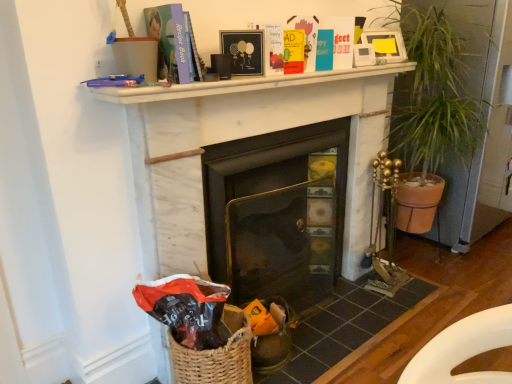
This screenshot has height=384, width=512. Describe the element at coordinates (294, 51) in the screenshot. I see `yellow matte paperback book at upper center, the first paperback book positioned from the right` at that location.

Describe the element at coordinates (242, 84) in the screenshot. I see `white matte shelf at upper center` at that location.

The width and height of the screenshot is (512, 384). What do you see at coordinates (341, 327) in the screenshot? I see `woven basket at lower left` at bounding box center [341, 327].

Measure the distance between point (257, 50) and camera.

The distance of point (257, 50) from camera is 5.00 feet.

Image resolution: width=512 pixels, height=384 pixels. What do you see at coordinates (441, 82) in the screenshot? I see `green leafy plant at right` at bounding box center [441, 82].

I want to click on matte blue paper at upper center, which is the 2th paperback book in back-to-front order, so coord(169,42).

Where is `yellow matte paperback book at upper center, the first paperback book positioned from the right`? The image size is (512, 384). yellow matte paperback book at upper center, the first paperback book positioned from the right is located at coordinates (294, 51).

The image size is (512, 384). In order to click on basket behind the matte blue paper at upper center, which is the 2th paperback book in back-to-front order in this screenshot , I will do `click(216, 356)`.

Considering the relative sizes of woven brown basket at lower left and matte blue paper at upper center, marked as the first paperback book in a left-to-right arrangement, in the image provided, is woven brown basket at lower left smaller than matte blue paper at upper center, marked as the first paperback book in a left-to-right arrangement,?

Actually, woven brown basket at lower left might be larger than matte blue paper at upper center, marked as the first paperback book in a left-to-right arrangement.

Is the depth of woven brown basket at lower left less than that of matte blue paper at upper center, marked as the first paperback book in a left-to-right arrangement?

No.

Would you say woven brown basket at lower left is a long distance from matte blue paper at upper center, which is the 2th paperback book in back-to-front order?

Actually, woven brown basket at lower left and matte blue paper at upper center, which is the 2th paperback book in back-to-front order, are a little close together.

Which of these two, matte white picture frame at upper right, the first picture frame from the right, or white matte shelf at upper center, stands taller?

Standing taller between the two is matte white picture frame at upper right, the first picture frame from the right.

Is matte white picture frame at upper right, which is counted as the 1th picture frame, starting from the back, far from white matte shelf at upper center?

No, there isn't a large distance between matte white picture frame at upper right, which is counted as the 1th picture frame, starting from the back, and white matte shelf at upper center.

Considering the positions of objects matte white picture frame at upper right, the first picture frame from the right, and white matte shelf at upper center in the image provided, who is in front, matte white picture frame at upper right, the first picture frame from the right, or white matte shelf at upper center?

white matte shelf at upper center is more forward.

How different are the orientations of matte white picture frame at upper right, the 1th picture frame viewed from the top, and white matte shelf at upper center in degrees?

23.2 degrees.

From the image's perspective, who appears lower, metallic black fireplace at center, the 2th fireplace viewed from the right, or matte blue paper at upper center, marked as the first paperback book in a left-to-right arrangement?

metallic black fireplace at center, the 2th fireplace viewed from the right, from the image's perspective.

Considering the positions of objects metallic black fireplace at center, arranged as the first fireplace when viewed from the left, and matte blue paper at upper center, arranged as the second paperback book when viewed from the right, in the image provided, who is more to the left, metallic black fireplace at center, arranged as the first fireplace when viewed from the left, or matte blue paper at upper center, arranged as the second paperback book when viewed from the right,?

From the viewer's perspective, matte blue paper at upper center, arranged as the second paperback book when viewed from the right, appears more on the left side.

At what (x,y) coordinates should I click in order to perform the action: click on paperback book in front of the metallic black fireplace at center, arranged as the first fireplace when viewed from the left. Please return your answer as a coordinate pair (x, y). The height and width of the screenshot is (384, 512). Looking at the image, I should click on (169, 42).

From a real-world perspective, between metallic black fireplace at center, the 2th fireplace viewed from the right, and matte blue paper at upper center, which is the 2th paperback book in back-to-front order, who is vertically higher?

matte blue paper at upper center, which is the 2th paperback book in back-to-front order, from a real-world perspective.

Can you confirm if white marble fireplace at center, which appears as the second fireplace when viewed from the left, is thinner than black matte picture frame at upper center, the 1th picture frame in the front-to-back sequence?

Incorrect, the width of white marble fireplace at center, which appears as the second fireplace when viewed from the left, is not less than that of black matte picture frame at upper center, the 1th picture frame in the front-to-back sequence.

Can you tell me how much white marble fireplace at center, which appears as the second fireplace when viewed from the left, and black matte picture frame at upper center, which ranks as the 2th picture frame in top-to-bottom order, differ in facing direction?

The angular difference between white marble fireplace at center, which appears as the second fireplace when viewed from the left, and black matte picture frame at upper center, which ranks as the 2th picture frame in top-to-bottom order, is 31.7 degrees.

Looking at this image, are white marble fireplace at center, which appears as the second fireplace when viewed from the left, and black matte picture frame at upper center, the 2th picture frame viewed from the right, located far from each other?

Actually, white marble fireplace at center, which appears as the second fireplace when viewed from the left, and black matte picture frame at upper center, the 2th picture frame viewed from the right, are a little close together.

Is white marble fireplace at center, which appears as the second fireplace when viewed from the left, shorter than yellow matte paperback book at upper center, the first paperback book positioned from the right?

In fact, white marble fireplace at center, which appears as the second fireplace when viewed from the left, may be taller than yellow matte paperback book at upper center, the first paperback book positioned from the right.

Is white marble fireplace at center, marked as the 1th fireplace in a right-to-left arrangement, in contact with yellow matte paperback book at upper center, positioned as the second paperback book in left-to-right order?

white marble fireplace at center, marked as the 1th fireplace in a right-to-left arrangement, is not next to yellow matte paperback book at upper center, positioned as the second paperback book in left-to-right order, and they're not touching.

Is point (348, 239) closer to viewer compared to point (285, 35)?

No, (348, 239) is behind (285, 35).

Looking at this image, is yellow matte paperback book at upper center, the first paperback book positioned from the right, located within white marble fireplace at center, marked as the 1th fireplace in a right-to-left arrangement?

No, yellow matte paperback book at upper center, the first paperback book positioned from the right, is located outside of white marble fireplace at center, marked as the 1th fireplace in a right-to-left arrangement.

From the image's perspective, relative to yellow matte paperback book at upper center, acting as the 2th paperback book starting from the front, is black matte picture frame at upper center, which ranks as the 2th picture frame in top-to-bottom order, above or below?

From the image's perspective, black matte picture frame at upper center, which ranks as the 2th picture frame in top-to-bottom order, appears below yellow matte paperback book at upper center, acting as the 2th paperback book starting from the front.

Does black matte picture frame at upper center, the 2th picture frame viewed from the right, have a smaller size compared to yellow matte paperback book at upper center, acting as the 2th paperback book starting from the front?

Actually, black matte picture frame at upper center, the 2th picture frame viewed from the right, might be larger than yellow matte paperback book at upper center, acting as the 2th paperback book starting from the front.

Which point is more distant from viewer, (258, 41) or (303, 62)?

Point (303, 62)

Is black matte picture frame at upper center, the 2th picture frame viewed from the right, positioned behind yellow matte paperback book at upper center, positioned as the second paperback book in left-to-right order?

No.

Is matte blue paper at upper center, marked as the first paperback book in a left-to-right arrangement, directly adjacent to metallic black fireplace at center, the 2th fireplace viewed from the right?

They are not placed beside each other.

Consider the image. Is matte blue paper at upper center, arranged as the second paperback book when viewed from the right, wider than metallic black fireplace at center, the 2th fireplace viewed from the right?

Indeed, matte blue paper at upper center, arranged as the second paperback book when viewed from the right, has a greater width compared to metallic black fireplace at center, the 2th fireplace viewed from the right.

Looking at this image, from the image's perspective, which object appears higher, matte blue paper at upper center, which is the 1th paperback book from front to back, or metallic black fireplace at center, arranged as the first fireplace when viewed from the left?

From the image's view, matte blue paper at upper center, which is the 1th paperback book from front to back, is above.

Is point (160, 32) positioned in front of point (247, 151)?

Yes, point (160, 32) is closer to viewer.

The width and height of the screenshot is (512, 384). What are the coordinates of `paperback book that is the 2nd object above the woven brown basket at lower left (from a real-world perspective)` in the screenshot? It's located at (169, 42).

The width and height of the screenshot is (512, 384). In order to click on the 2nd picture frame behind the white matte shelf at upper center in this screenshot , I will do `click(386, 45)`.

When comparing their distances from white marble fireplace at center, marked as the 1th fireplace in a right-to-left arrangement, does matte white picture frame at upper right, which is counted as the second picture frame, starting from the front, or woven basket at lower left seem closer?

matte white picture frame at upper right, which is counted as the second picture frame, starting from the front, lies closer to white marble fireplace at center, marked as the 1th fireplace in a right-to-left arrangement, than the other object.

Estimate the real-world distances between objects in this image. Which object is closer to woven basket at lower left, white marble fireplace at center, marked as the 1th fireplace in a right-to-left arrangement, or black matte picture frame at upper center, positioned as the 1th picture frame in left-to-right order?

white marble fireplace at center, marked as the 1th fireplace in a right-to-left arrangement, lies closer to woven basket at lower left than the other object.

When comparing their distances from green leafy plant at right, does matte white picture frame at upper right, placed as the 2th picture frame when sorted from bottom to top, or matte blue paper at upper center, arranged as the second paperback book when viewed from the right, seem closer?

matte white picture frame at upper right, placed as the 2th picture frame when sorted from bottom to top.

From the image, which object appears to be nearer to white matte shelf at upper center, black matte picture frame at upper center, positioned as the first picture frame in bottom-to-top order, or matte white picture frame at upper right, which is counted as the second picture frame, starting from the front?

The object closer to white matte shelf at upper center is black matte picture frame at upper center, positioned as the first picture frame in bottom-to-top order.

Estimate the real-world distances between objects in this image. Which object is further from matte blue paper at upper center, which is the 1th paperback book from front to back, white matte shelf at upper center or metallic black fireplace at center, the 2th fireplace viewed from the right?

metallic black fireplace at center, the 2th fireplace viewed from the right, is positioned further to the anchor matte blue paper at upper center, which is the 1th paperback book from front to back.

From the image, which object appears to be farther from white matte shelf at upper center, matte white picture frame at upper right, the 1th picture frame viewed from the top, or metallic black fireplace at center, arranged as the first fireplace when viewed from the left?

metallic black fireplace at center, arranged as the first fireplace when viewed from the left.

Based on their spatial positions, is matte white picture frame at upper right, which is counted as the second picture frame, starting from the front, or black matte picture frame at upper center, the 1th picture frame in the front-to-back sequence, further from woven brown basket at lower left?

The object further to woven brown basket at lower left is matte white picture frame at upper right, which is counted as the second picture frame, starting from the front.

From the image, which object appears to be farther from woven basket at lower left, black matte picture frame at upper center, the 1th picture frame in the front-to-back sequence, or matte white picture frame at upper right, the first picture frame from the right?

Among the two, matte white picture frame at upper right, the first picture frame from the right, is located further to woven basket at lower left.

This screenshot has height=384, width=512. I want to click on picture frame between matte white picture frame at upper right, placed as the 2th picture frame when sorted from bottom to top, and woven basket at lower left in the up-down direction, so click(x=244, y=50).

I want to click on paperback book between yellow matte paperback book at upper center, positioned as the second paperback book in left-to-right order, and woven basket at lower left, in the vertical direction, so click(169, 42).

Find the location of a particular element. fireplace between black matte picture frame at upper center, the 2th picture frame viewed from the right, and metallic black fireplace at center, the 2th fireplace viewed from the right, from top to bottom is located at coordinates pyautogui.click(x=250, y=136).

Find the location of a particular element. The image size is (512, 384). paperback book situated between metallic black fireplace at center, arranged as the first fireplace when viewed from the left, and green leafy plant at right from left to right is located at coordinates (294, 51).